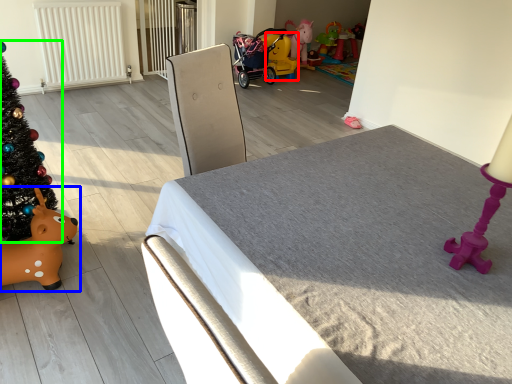
Question: Based on their relative distances, which object is farther from toy (highlighted by a red box)? Choose from toy (highlighted by a blue box) and christmas tree (highlighted by a green box).

Choices:
 (A) toy
 (B) christmas tree

Answer: (A)